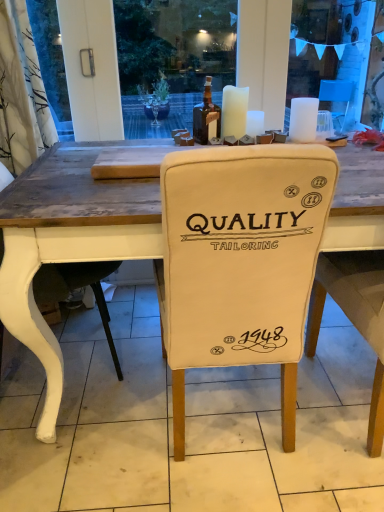
At what (x,y) coordinates should I click in order to perform the action: click on vacant space that is to the left of white fabric chair at center. Please return your answer as a coordinate pair (x, y). Looking at the image, I should click on (89, 441).